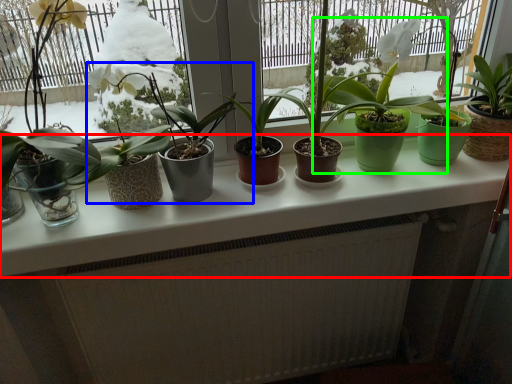
Question: Considering the real-world distances, which object is closest to counter top (highlighted by a red box)? houseplant (highlighted by a blue box) or houseplant (highlighted by a green box).

Choices:
 (A) houseplant
 (B) houseplant

Answer: (A)